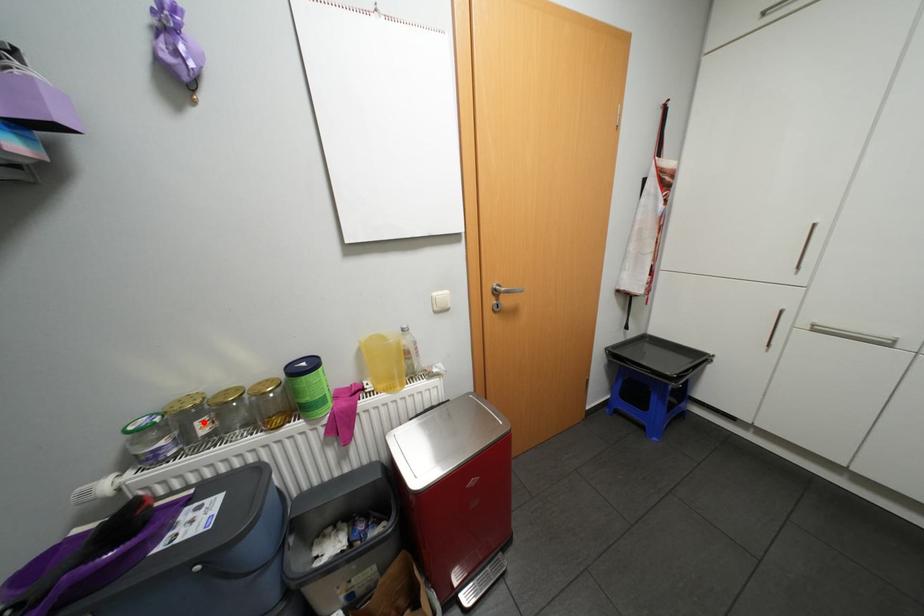
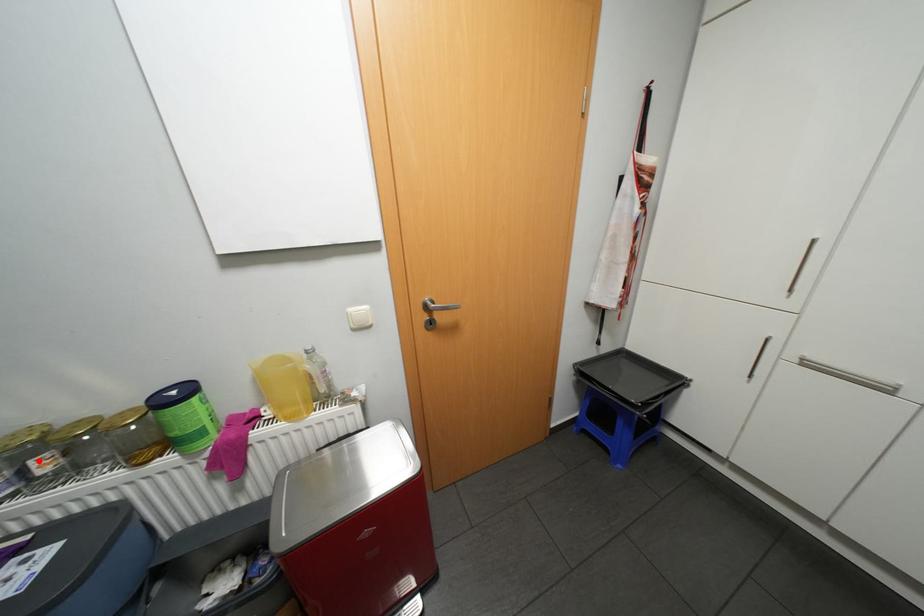
I am providing you with two images of the same scene from different viewpoints. A red point is marked on the first image and another point is marked on the second image. Is the marked point in image1 the same physical position as the marked point in image2?

Yes